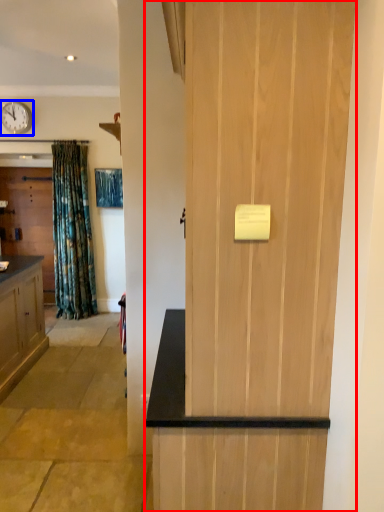
Question: Which object is closer to the camera taking this photo, door (highlighted by a red box) or clock (highlighted by a blue box)?

Choices:
 (A) door
 (B) clock

Answer: (A)